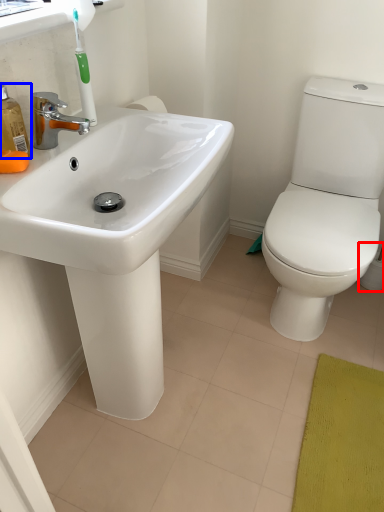
Question: Which object is further to the camera taking this photo, toilet paper (highlighted by a red box) or soap dispenser (highlighted by a blue box)?

Choices:
 (A) toilet paper
 (B) soap dispenser

Answer: (A)